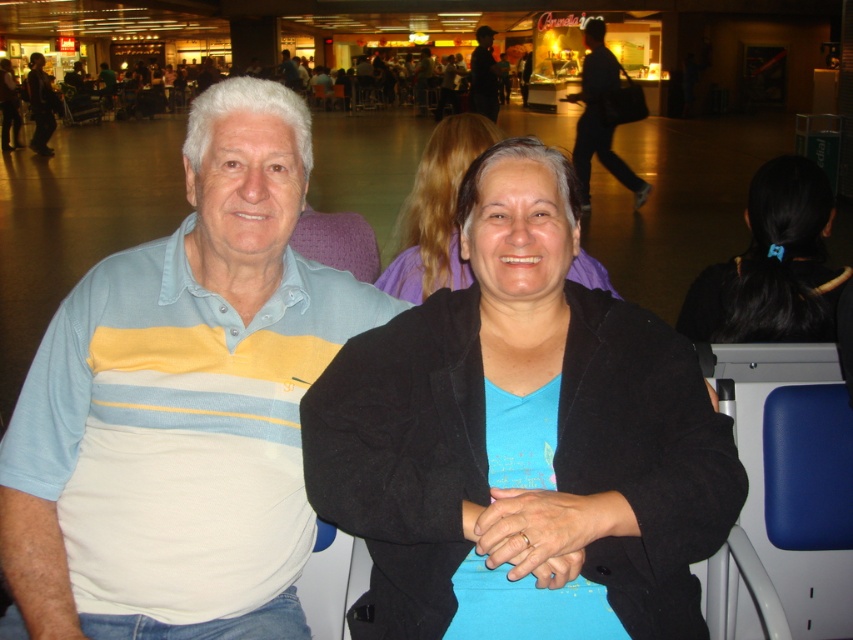
Question: Does light blue and yellow striped polo shirt at center lie behind matte black jacket at upper left?

Choices:
 (A) yes
 (B) no

Answer: (B)

Question: Estimate the real-world distances between objects in this image. Which object is farther from the black soft jacket at center?

Choices:
 (A) black hair at upper right
 (B) blue matte jacket at center
 (C) light blue striped polo shirt at center
 (D) matte black jacket at upper left

Answer: (C)

Question: Does black hair at upper right appear on the right side of blue matte jacket at center?

Choices:
 (A) no
 (B) yes

Answer: (B)

Question: Among these objects, which one is farthest from the camera?

Choices:
 (A) blue matte jacket at center
 (B) black hair at upper right

Answer: (B)

Question: From the image, what is the correct spatial relationship of black soft jacket at center in relation to matte black jacket at upper left?

Choices:
 (A) below
 (B) above

Answer: (A)

Question: Among these objects, which one is nearest to the camera?

Choices:
 (A) matte black jacket at upper left
 (B) dark blue jeans at center
 (C) black soft jacket at center
 (D) black hair at upper right

Answer: (C)